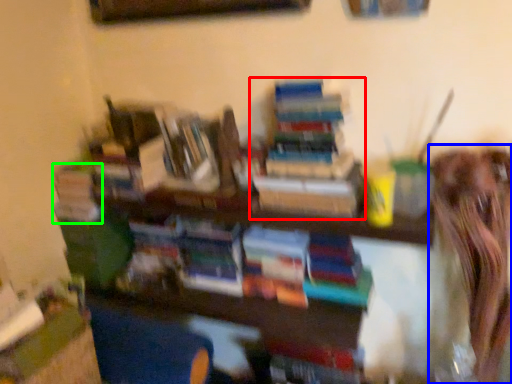
Question: Based on their relative distances, which object is farther from book (highlighted by a red box)? Choose from person (highlighted by a blue box) and book (highlighted by a green box).

Choices:
 (A) person
 (B) book

Answer: (B)